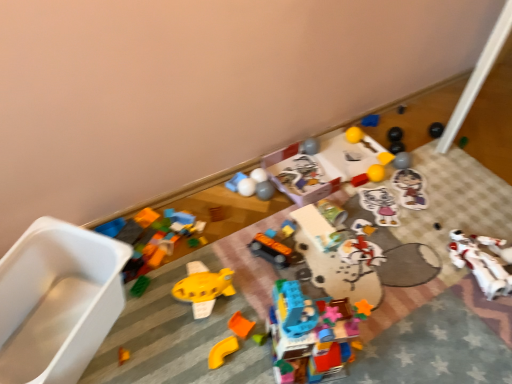
Locate an element on the screen. The image size is (512, 384). free spot to the right of white plastic container at left, the seventeenth toy when ordered from right to left is located at coordinates (170, 331).